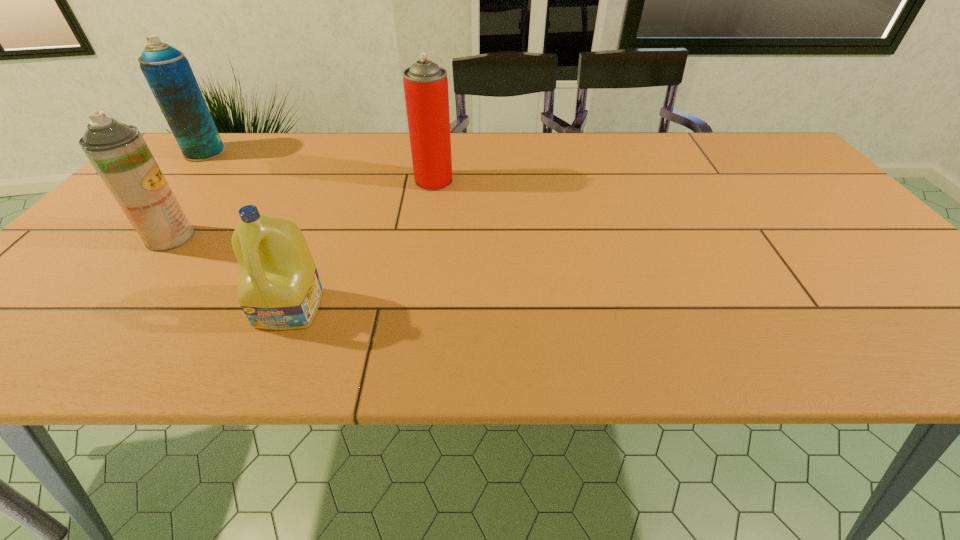
Identify the location of object at the far left corner. Image resolution: width=960 pixels, height=540 pixels. (167, 71).

I want to click on vacant area at the far edge of the desktop, so click(x=494, y=154).

Where is `vacant space at the near edge of the desktop`? This screenshot has width=960, height=540. vacant space at the near edge of the desktop is located at coordinates (861, 333).

Identify the location of vacant space at the left edge. The height and width of the screenshot is (540, 960). (117, 271).

The width and height of the screenshot is (960, 540). Find the location of `vacant position at the right edge of the desktop`. vacant position at the right edge of the desktop is located at coordinates (786, 197).

At what (x,y) coordinates should I click in order to perform the action: click on vacant area at the far left corner of the desktop. Please return your answer as a coordinate pair (x, y). This screenshot has height=540, width=960. Looking at the image, I should click on (232, 137).

In the image, there is a desktop. Identify the location of free region at the far right corner. The width and height of the screenshot is (960, 540). (755, 164).

Where is `vacant area that lies between the third farthest object and the nearest object`? Image resolution: width=960 pixels, height=540 pixels. vacant area that lies between the third farthest object and the nearest object is located at coordinates (230, 273).

Find the location of a particular element. The height and width of the screenshot is (540, 960). unoccupied area between the third object from left to right and the third farthest object is located at coordinates (230, 273).

Image resolution: width=960 pixels, height=540 pixels. In order to click on vacant space in between the rightmost object and the second nearest object in this screenshot , I will do `click(302, 209)`.